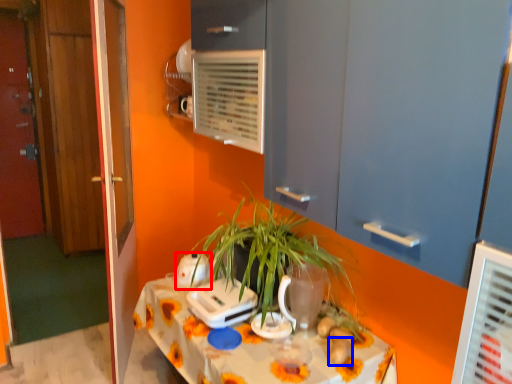
Question: Which point is further to the camera, appliance (highlighted by a red box) or food (highlighted by a blue box)?

Choices:
 (A) appliance
 (B) food

Answer: (A)